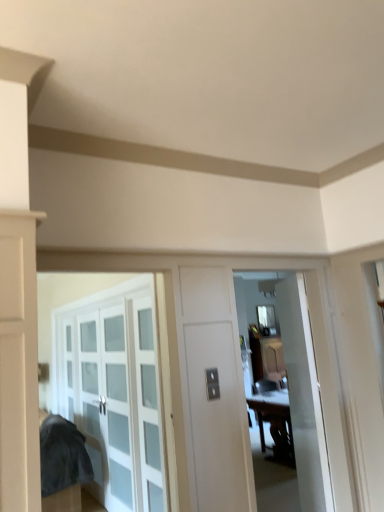
Question: Do you think wooden table at center is within clear glass window at center, or outside of it?

Choices:
 (A) inside
 (B) outside

Answer: (B)

Question: Does point click(276, 393) appear closer or farther from the camera than point click(258, 310)?

Choices:
 (A) closer
 (B) farther

Answer: (A)

Question: Which of these objects is positioned farthest from the clear glass window at center?

Choices:
 (A) white glossy door at center
 (B) clear glass cabinet at left
 (C) wooden table at center

Answer: (A)

Question: Estimate the real-world distances between objects in this image. Which object is farther from the white glossy door at center?

Choices:
 (A) wooden table at center
 (B) clear glass cabinet at left
 (C) clear glass window at center

Answer: (C)